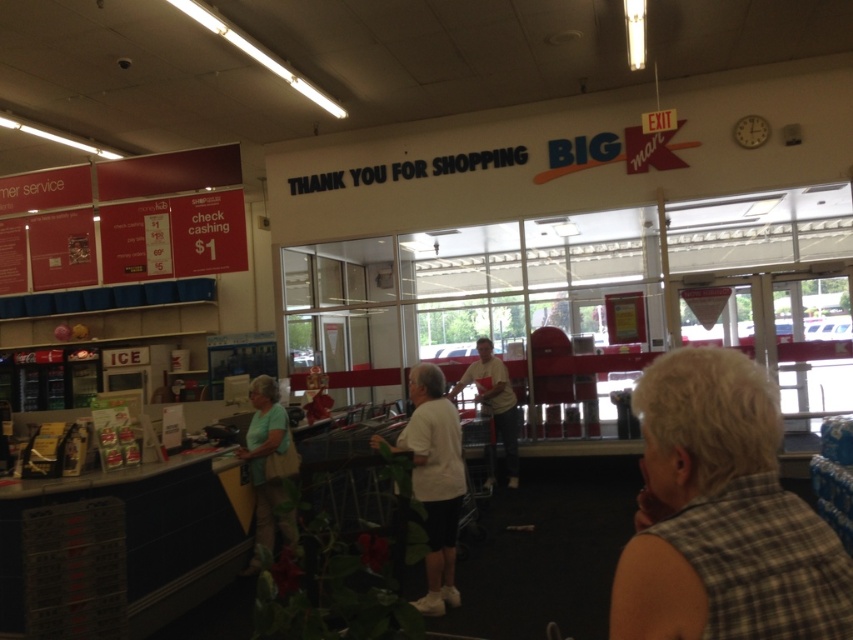
How much distance is there between brown plaid shirt at lower right and light green fabric shirt at center?

4.21 meters

In the scene shown: Does brown plaid shirt at lower right lie in front of light green fabric shirt at center?

Yes.

Where is `brown plaid shirt at lower right`? The height and width of the screenshot is (640, 853). brown plaid shirt at lower right is located at coordinates (722, 515).

What are the coordinates of `white matte shirt at center` in the screenshot? It's located at (434, 481).

Does point (434, 472) come closer to viewer compared to point (476, 364)?

Yes.

Locate an element on the screen. white matte shirt at center is located at coordinates (434, 481).

Can you confirm if brown plaid shirt at lower right is bigger than white cotton shirt at center?

No.

Does brown plaid shirt at lower right appear on the right side of white cotton shirt at center?

Indeed, brown plaid shirt at lower right is positioned on the right side of white cotton shirt at center.

Which is in front, point (761, 419) or point (498, 362)?

Point (761, 419) is in front.

Where is `brown plaid shirt at lower right`? This screenshot has height=640, width=853. brown plaid shirt at lower right is located at coordinates (722, 515).